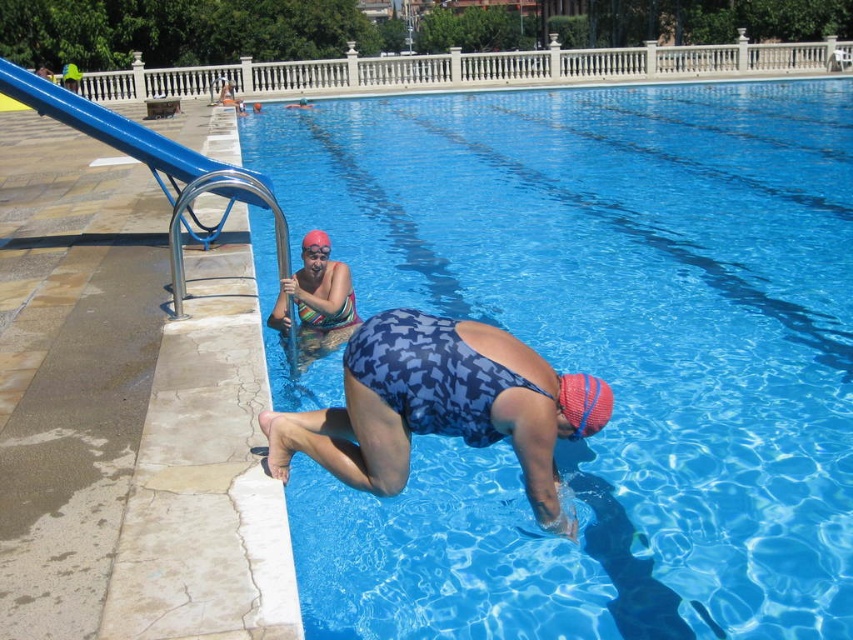
Between multicolored swimsuit at center and red matte swim cap at upper center, which one is positioned higher?

red matte swim cap at upper center is above.

Does multicolored swimsuit at center have a smaller size compared to red matte swim cap at upper center?

No.

Is point (308, 316) positioned after point (312, 234)?

Yes, point (308, 316) is farther from viewer.

The width and height of the screenshot is (853, 640). In order to click on multicolored swimsuit at center in this screenshot , I will do `click(316, 305)`.

Is blue printed swimsuit at center below red mesh swim cap at lower center?

Indeed, blue printed swimsuit at center is positioned under red mesh swim cap at lower center.

From the picture: Between blue printed swimsuit at center and red mesh swim cap at lower center, which one is positioned higher?

red mesh swim cap at lower center is above.

Does point (467, 342) come closer to viewer compared to point (608, 406)?

Yes, it is.

Locate an element on the screen. Image resolution: width=853 pixels, height=640 pixels. blue printed swimsuit at center is located at coordinates (428, 406).

Does blue printed swimsuit at center appear over red matte swim cap at upper center?

No.

Which of these two, blue printed swimsuit at center or red matte swim cap at upper center, stands shorter?

red matte swim cap at upper center

This screenshot has height=640, width=853. Describe the element at coordinates (428, 406) in the screenshot. I see `blue printed swimsuit at center` at that location.

Find the location of a particular element. The height and width of the screenshot is (640, 853). blue printed swimsuit at center is located at coordinates (428, 406).